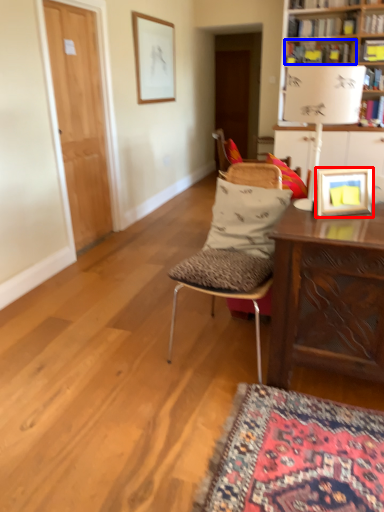
Question: Which object is further to the camera taking this photo, picture frame (highlighted by a red box) or book (highlighted by a blue box)?

Choices:
 (A) picture frame
 (B) book

Answer: (B)